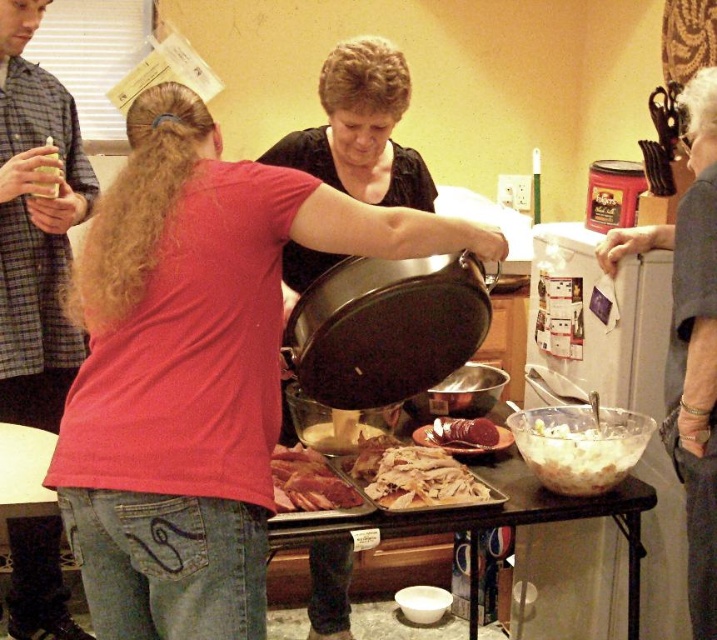
Looking at this image, you are organizing a kitchen pantry and need to place the brushed metal can at upper left and the sliced pink meat at center onto a shelf. If the shelf has limited space, which item should you place first to ensure both can fit?

The brushed metal can at upper left should be placed first since it is positioned on the left side of the sliced pink meat at center, so placing it first allows the sliced pink meat at center to be placed to its right without overlapping.